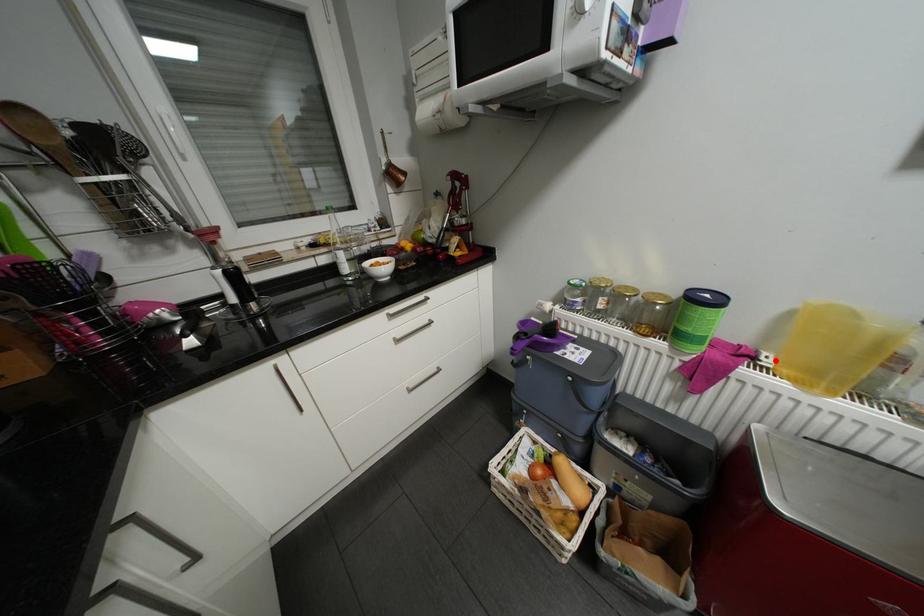
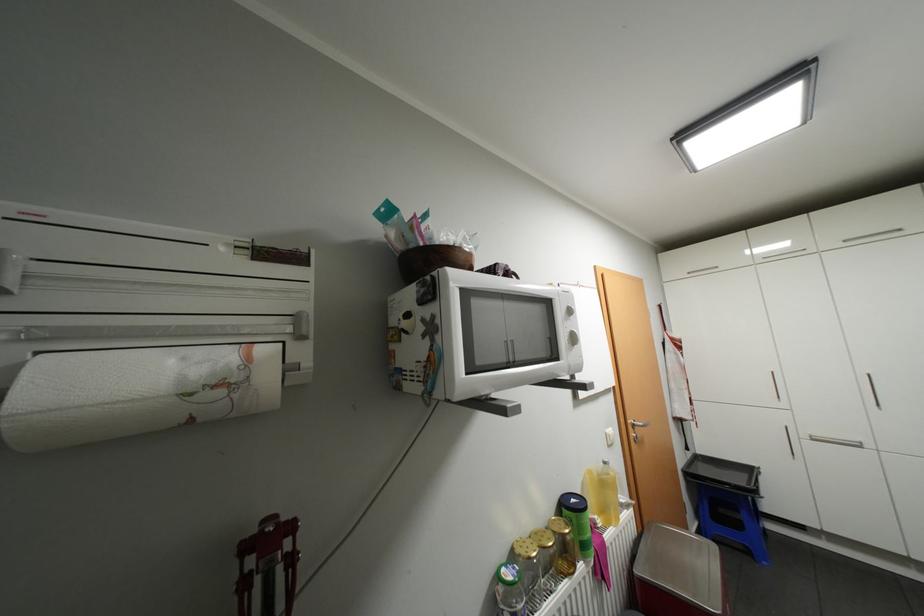
Locate, in the second image, the point that corresponds to the highlighted location in the first image.

(606, 521)